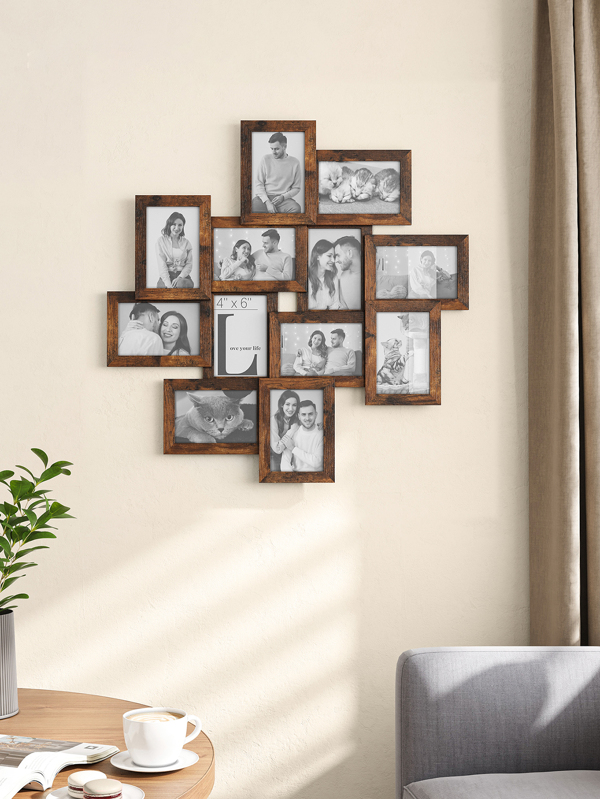
Where is `things on the table`? This screenshot has width=600, height=799. things on the table is located at coordinates (12, 689), (29, 505), (49, 753), (103, 793), (81, 778), (134, 790), (193, 750), (160, 736).